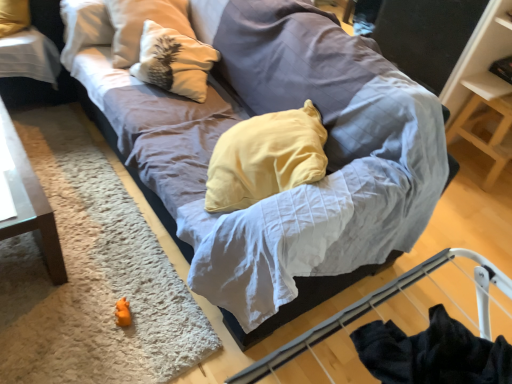
Image resolution: width=512 pixels, height=384 pixels. Find the location of `free location in front of orange plush toy at lower left`. free location in front of orange plush toy at lower left is located at coordinates [x=105, y=351].